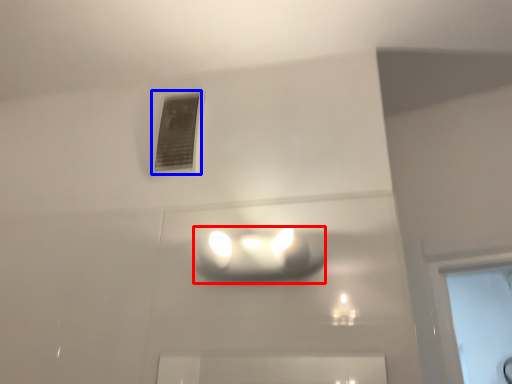
Question: Which of the following is the closest to the observer, lamp (highlighted by a red box) or window (highlighted by a blue box)?

Choices:
 (A) lamp
 (B) window

Answer: (A)